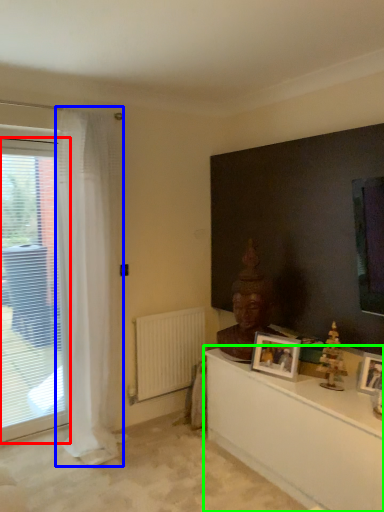
Question: Considering the real-world distances, which object is closest to window (highlighted by a red box)? curtain (highlighted by a blue box) or table (highlighted by a green box).

Choices:
 (A) curtain
 (B) table

Answer: (A)